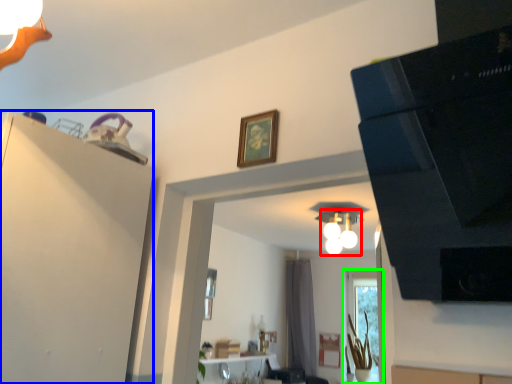
Question: Which object is positioned closest to light fixture (highlighted by a red box)? Select from dresser (highlighted by a blue box) and window (highlighted by a green box).

Choices:
 (A) dresser
 (B) window

Answer: (B)